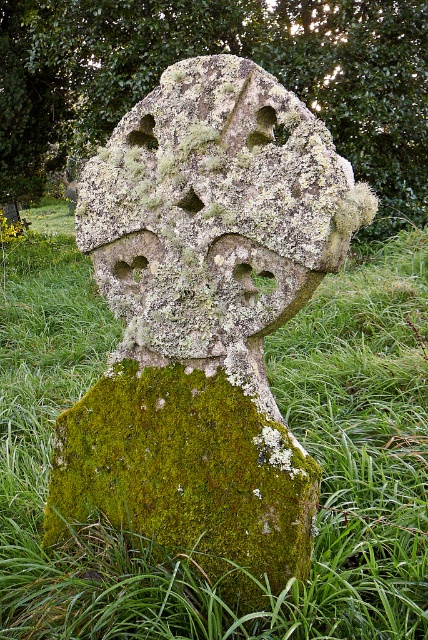
Question: Can you confirm if lichen-covered stone cross at center is smaller than green mossy stone at lower center?

Choices:
 (A) no
 (B) yes

Answer: (A)

Question: Estimate the real-world distances between objects in this image. Which object is farther from the lichen-covered stone cross at center?

Choices:
 (A) green mossy stone at lower center
 (B) green mossy stone cross at center

Answer: (A)

Question: Which object is farther from the camera taking this photo?

Choices:
 (A) lichen-covered stone cross at center
 (B) green mossy stone at lower center

Answer: (B)

Question: Which point appears farthest from the camera in this image?

Choices:
 (A) (181, 196)
 (B) (246, 225)

Answer: (A)

Question: Is lichen-covered stone cross at center wider than green mossy stone at lower center?

Choices:
 (A) yes
 (B) no

Answer: (A)

Question: Can you confirm if green mossy stone cross at center is bigger than green mossy stone at lower center?

Choices:
 (A) no
 (B) yes

Answer: (B)